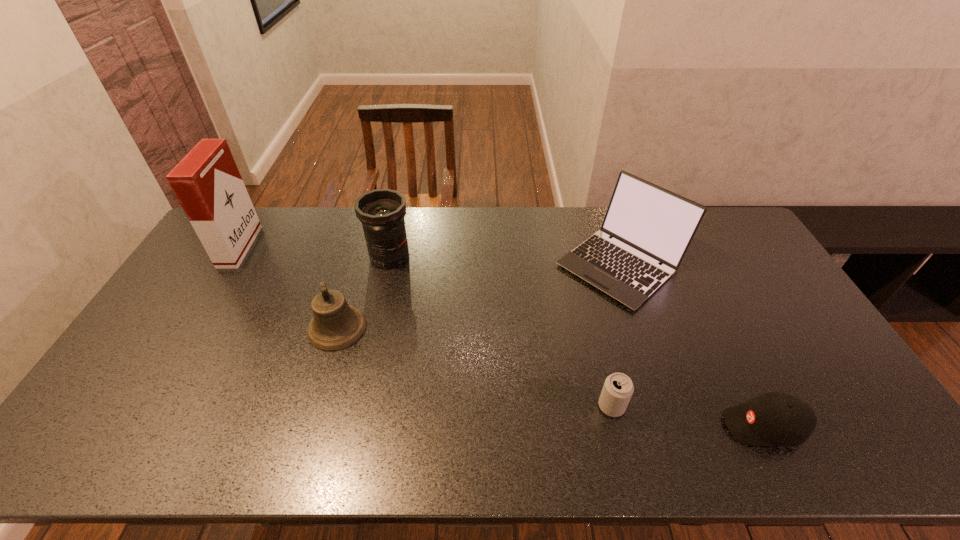
The width and height of the screenshot is (960, 540). What are the coordinates of `vacant area situated 0.360m at the front screen of the laptop_computer` in the screenshot? It's located at (449, 266).

Identify the location of free spot located 0.050m on the front of the telephoto lens. (384, 282).

Where is `free space located on the back of the bell`? The height and width of the screenshot is (540, 960). free space located on the back of the bell is located at coordinates (359, 255).

Find the location of `vacant point located 0.100m on the front of the can`. vacant point located 0.100m on the front of the can is located at coordinates (624, 458).

The image size is (960, 540). Identify the location of free location located 0.050m with a logo on the front of the baseball cap. (704, 426).

At what (x,y) coordinates should I click in order to perform the action: click on vacant space situated 0.150m with a logo on the front of the baseball cap. Please return your answer as a coordinate pair (x, y). Looking at the image, I should click on (662, 426).

Find the location of a particular element. free space located with a logo on the front of the baseball cap is located at coordinates (606, 426).

Locate an element on the screen. cigarette_case that is at the far edge is located at coordinates (207, 183).

This screenshot has height=540, width=960. Identify the location of laptop_computer positioned at the far edge. (649, 225).

Find the location of a particular element. telephoto lens located at the far edge is located at coordinates pos(381,211).